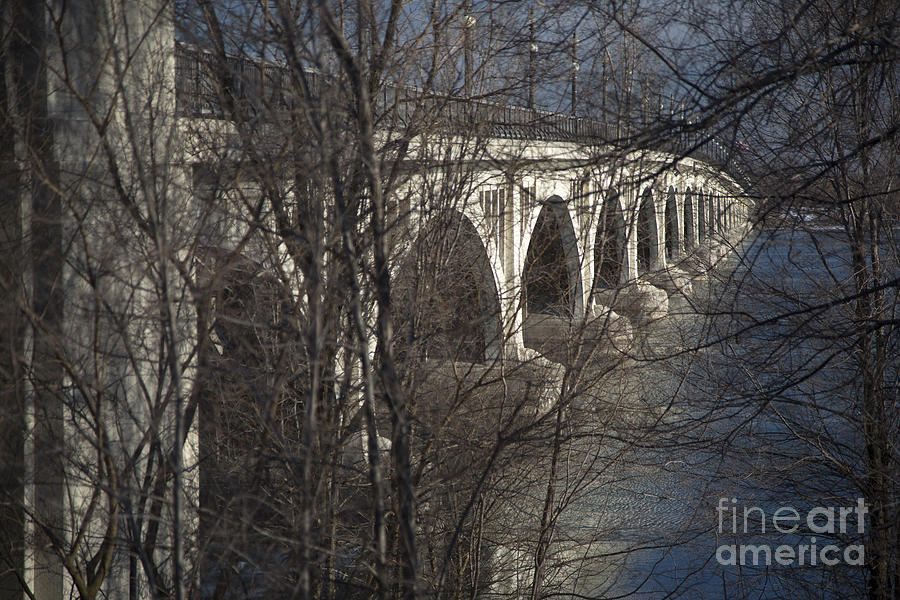
Locate an element on the screen. art is located at coordinates (832, 517).